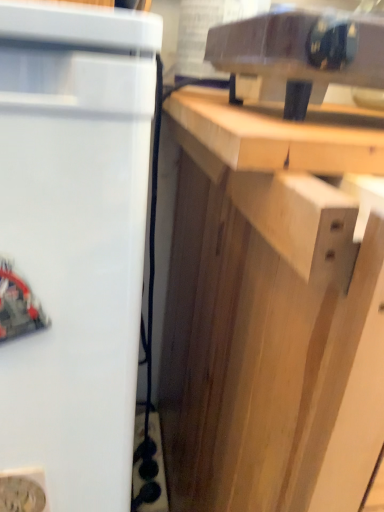
Question: Is light wood cabinet at center surrounding white matte refrigerator at left?

Choices:
 (A) no
 (B) yes

Answer: (A)

Question: Is light wood cabinet at center to the right of white matte refrigerator at left from the viewer's perspective?

Choices:
 (A) no
 (B) yes

Answer: (B)

Question: Are light wood cabinet at center and white matte refrigerator at left located far from each other?

Choices:
 (A) yes
 (B) no

Answer: (B)

Question: Can you confirm if light wood cabinet at center is thinner than white matte refrigerator at left?

Choices:
 (A) yes
 (B) no

Answer: (B)

Question: Can you confirm if light wood cabinet at center is smaller than white matte refrigerator at left?

Choices:
 (A) no
 (B) yes

Answer: (A)

Question: Is light brown wood at upper right to the left or to the right of light wood cabinet at center in the image?

Choices:
 (A) right
 (B) left

Answer: (B)

Question: From a real-world perspective, is light brown wood at upper right positioned above or below light wood cabinet at center?

Choices:
 (A) above
 (B) below

Answer: (A)

Question: In terms of height, does light brown wood at upper right look taller or shorter compared to light wood cabinet at center?

Choices:
 (A) short
 (B) tall

Answer: (A)

Question: Looking at the image, does light brown wood at upper right seem bigger or smaller compared to light wood cabinet at center?

Choices:
 (A) small
 (B) big

Answer: (A)

Question: From their relative heights in the image, would you say transparent plastic container at upper center is taller or shorter than light brown wood at upper right?

Choices:
 (A) tall
 (B) short

Answer: (A)

Question: From a real-world perspective, is transparent plastic container at upper center positioned above or below light brown wood at upper right?

Choices:
 (A) above
 (B) below

Answer: (A)

Question: Is transparent plastic container at upper center wider or thinner than light brown wood at upper right?

Choices:
 (A) thin
 (B) wide

Answer: (A)

Question: Is transparent plastic container at upper center spatially inside light brown wood at upper right, or outside of it?

Choices:
 (A) outside
 (B) inside

Answer: (A)

Question: Do you think light wood cabinet at center is within light brown wood at upper right, or outside of it?

Choices:
 (A) outside
 (B) inside

Answer: (A)

Question: Considering the positions of light wood cabinet at center and light brown wood at upper right in the image, is light wood cabinet at center wider or thinner than light brown wood at upper right?

Choices:
 (A) wide
 (B) thin

Answer: (A)